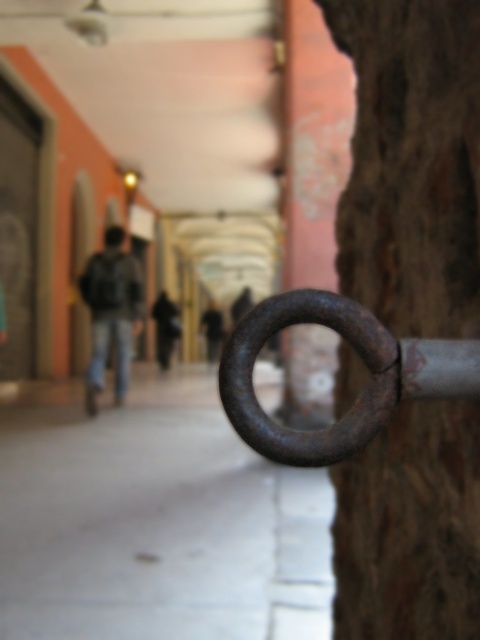
Does point (108, 300) come behind point (164, 316)?

No, (108, 300) is closer to viewer.

Who is more distant from viewer, (x=129, y=352) or (x=171, y=321)?

Positioned behind is point (x=171, y=321).

Between point (127, 364) and point (158, 349), which one is positioned behind?

Point (158, 349)

Where is `dark gray backpack at center`? dark gray backpack at center is located at coordinates (110, 312).

Can you confirm if smooth concrete pavement at center is wider than dark gray backpack at center?

Correct, the width of smooth concrete pavement at center exceeds that of dark gray backpack at center.

What do you see at coordinates (154, 518) in the screenshot? Image resolution: width=480 pixels, height=640 pixels. I see `smooth concrete pavement at center` at bounding box center [154, 518].

Who is more forward, (304, 548) or (85, 298)?

Point (304, 548)

Find the location of a particular element. The height and width of the screenshot is (640, 480). smooth concrete pavement at center is located at coordinates (154, 518).

Which is below, rusty metal ring at right or dark gray backpack at center?

rusty metal ring at right is lower down.

Can you confirm if rusty metal ring at right is thinner than dark gray backpack at center?

Yes, rusty metal ring at right is thinner than dark gray backpack at center.

Find the location of `rusty metal ring at right`. rusty metal ring at right is located at coordinates (359, 396).